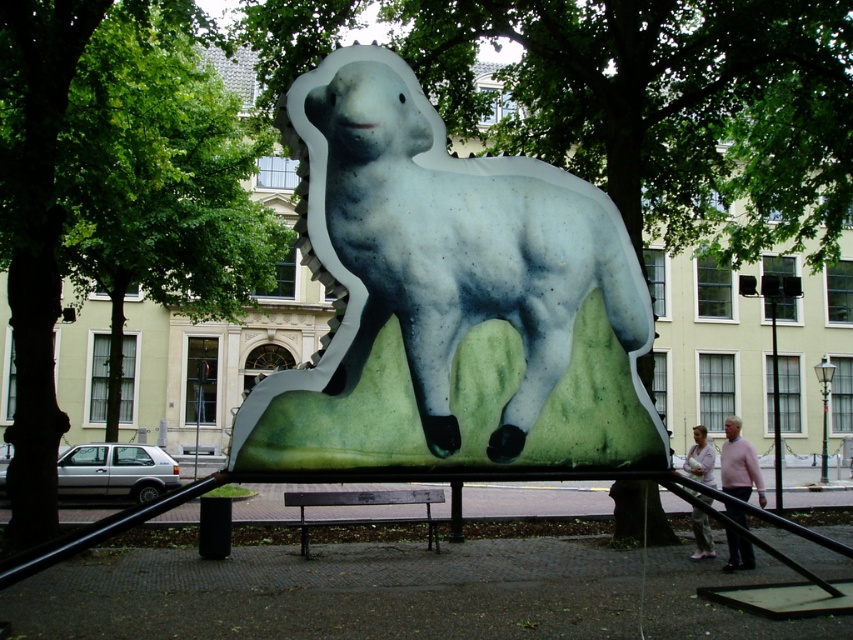
Is point (471, 294) farther from viewer compared to point (149, 28)?

No, it is in front of (149, 28).

Is point (573, 371) positioned before point (136, 120)?

Yes.

The image size is (853, 640). In order to click on matte white lamb at center in this screenshot , I will do `click(451, 300)`.